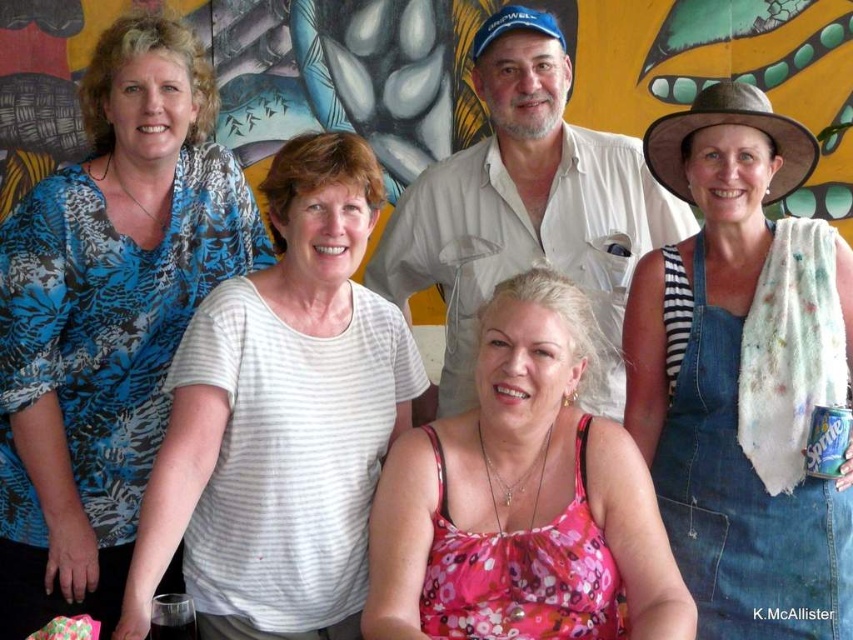
Between point (263, 243) and point (653, 122), which one is positioned in front?

Point (653, 122) is more forward.

Is point (79, 358) more distant than point (775, 374)?

Yes, it is.

Where is `blue printed blouse at upper left`? The width and height of the screenshot is (853, 640). blue printed blouse at upper left is located at coordinates (107, 316).

Can you confirm if blue printed blouse at upper left is taller than pink floral tank top at center?

Yes, blue printed blouse at upper left is taller than pink floral tank top at center.

Does blue printed blouse at upper left appear on the right side of pink floral tank top at center?

In fact, blue printed blouse at upper left is to the left of pink floral tank top at center.

Which is behind, point (189, 32) or point (596, 529)?

The point (189, 32) is more distant.

Image resolution: width=853 pixels, height=640 pixels. Find the location of `blue printed blouse at upper left`. blue printed blouse at upper left is located at coordinates (107, 316).

Can you confirm if denim overalls at lower right is bigger than pink floral tank top at center?

Yes.

Is denim overalls at lower right shorter than pink floral tank top at center?

No.

Image resolution: width=853 pixels, height=640 pixels. What do you see at coordinates (734, 378) in the screenshot?
I see `denim overalls at lower right` at bounding box center [734, 378].

Identify the location of denim overalls at lower right. (734, 378).